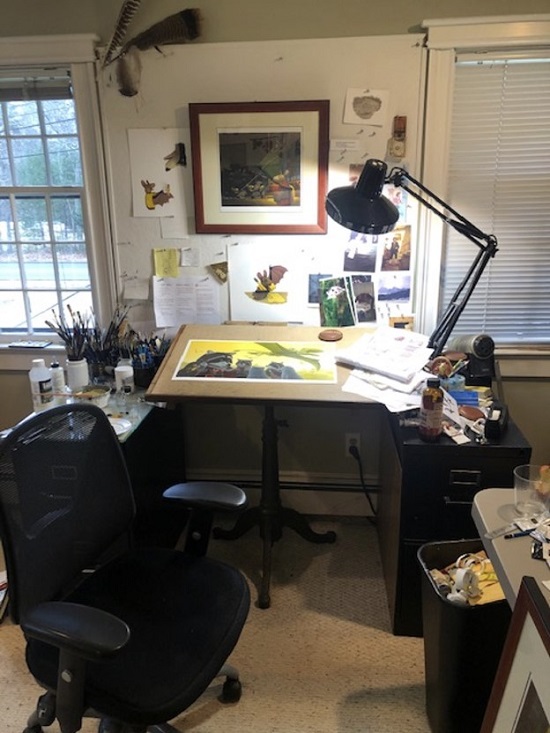
Locate an element on the screen. The width and height of the screenshot is (550, 733). computer chair, black is located at coordinates (170, 604).